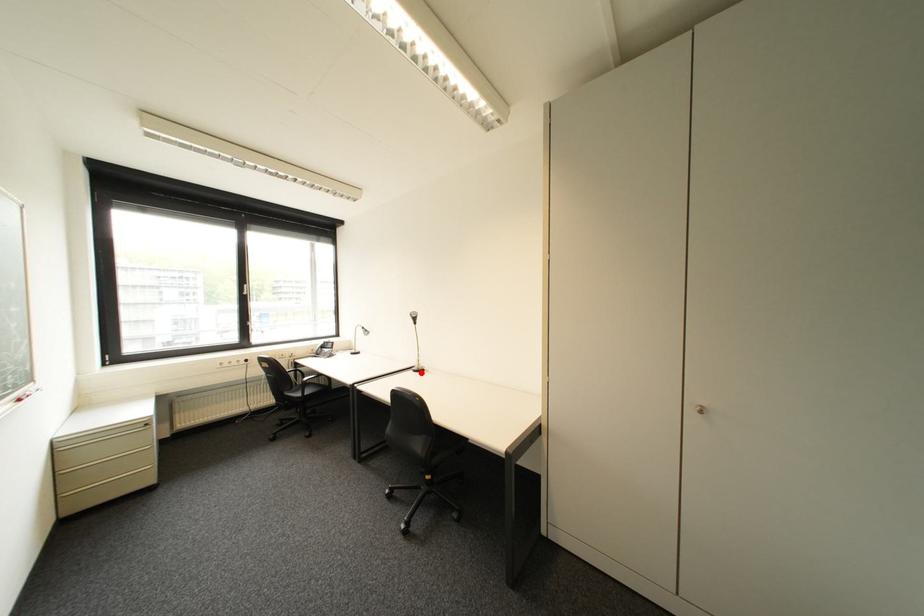
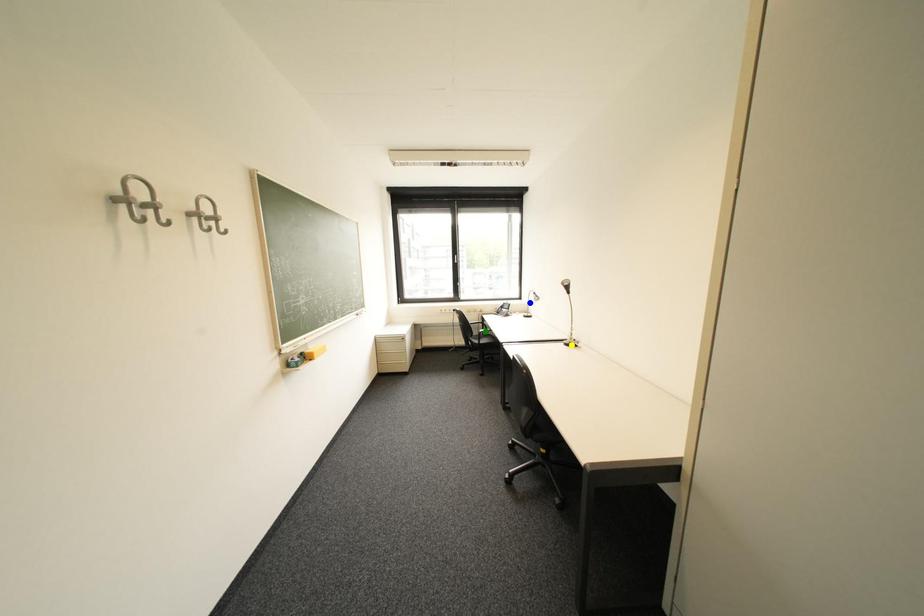
Question: I am providing you with two images of the same scene from different viewpoints. A red point is marked on the first image. You are given multiple points on the second image. In image 2, which mark is for the same physical point as the one in image 1?

Choices:
 (A) yellow point
 (B) green point
 (C) blue point

Answer: (A)